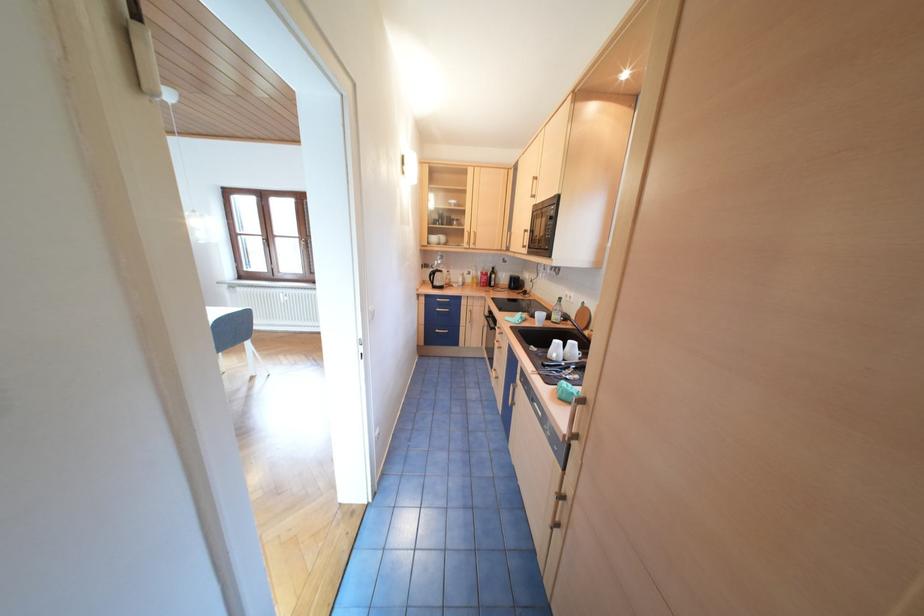
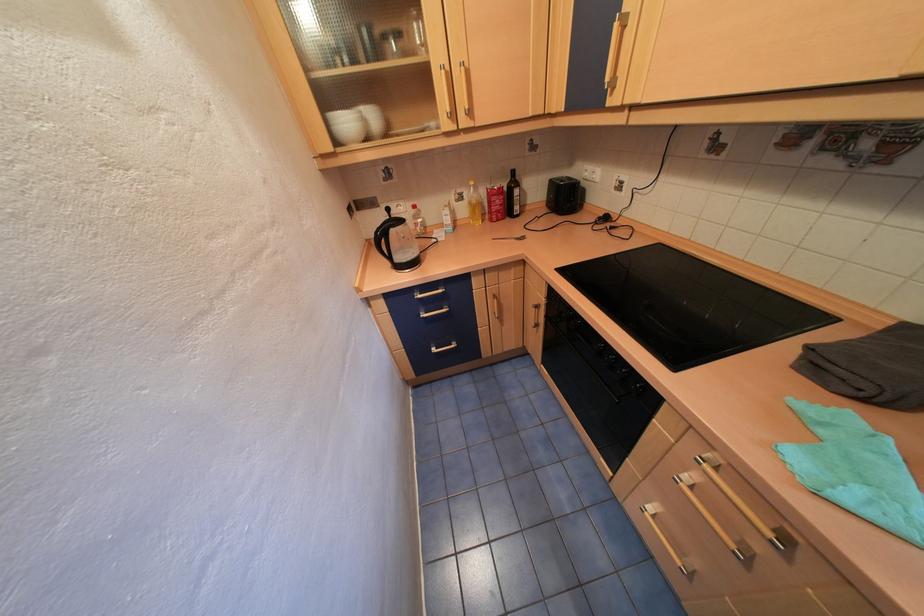
Find the pixel in the second image that matches (479,244) in the first image.

(464, 114)